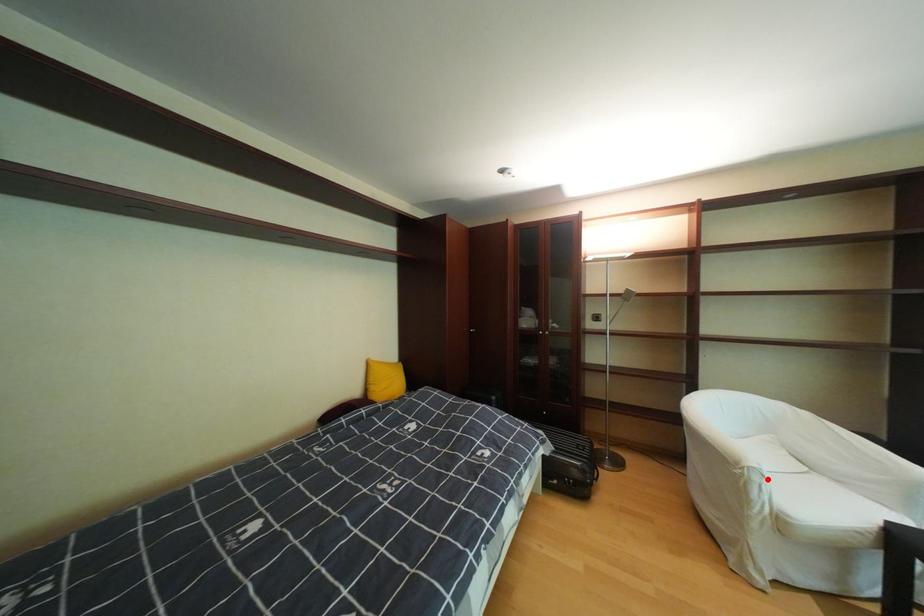
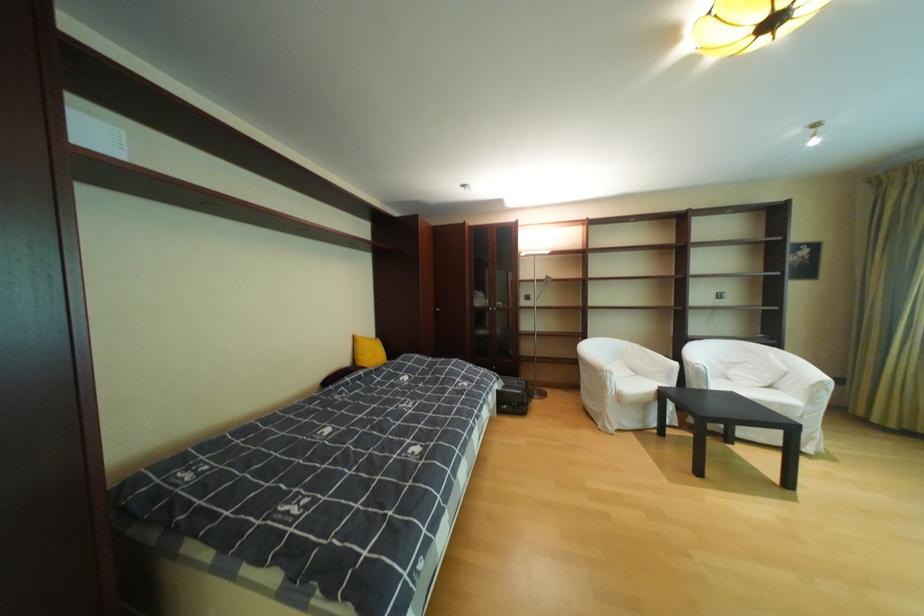
Find the pixel in the second image that matches the highlighted location in the first image.

(621, 377)